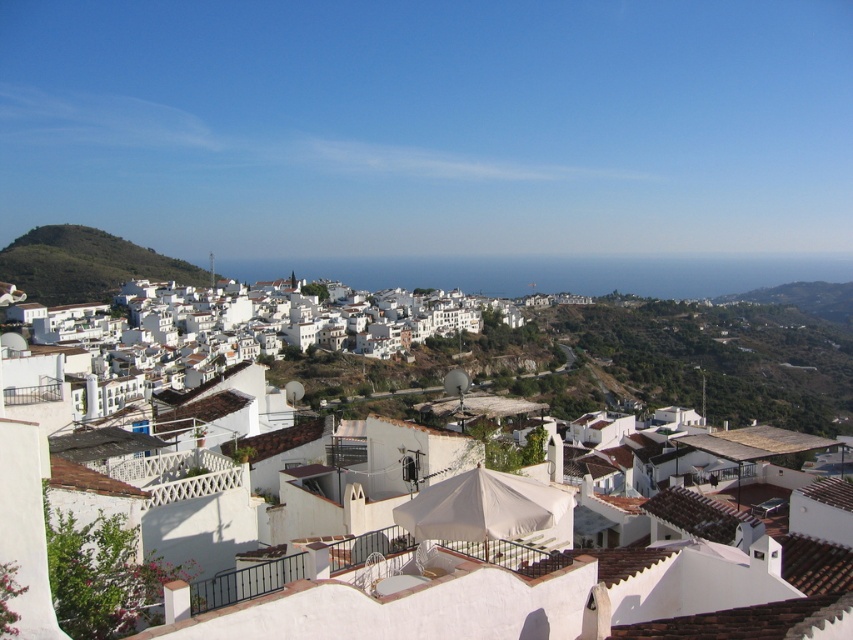
Question: Is white matte roof at center above white matte/rough houses at center?

Choices:
 (A) yes
 (B) no

Answer: (B)

Question: Can you confirm if white matte roof at center is bigger than white matte/rough houses at center?

Choices:
 (A) yes
 (B) no

Answer: (B)

Question: Is white matte roof at center wider than white matte/rough houses at center?

Choices:
 (A) no
 (B) yes

Answer: (A)